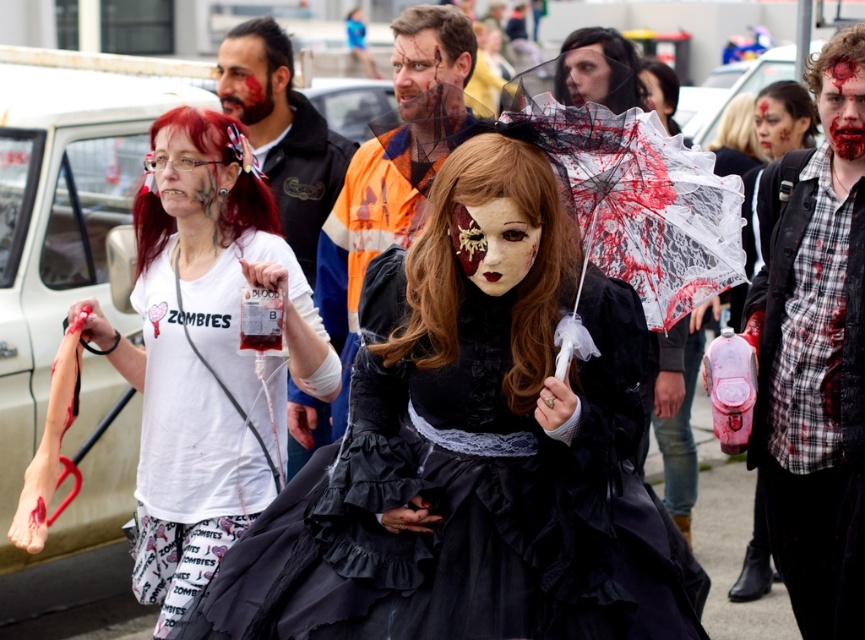
Question: Which is nearer to the matte plastic face at center?

Choices:
 (A) matte black mask at center
 (B) plaid fabric shirt at center

Answer: (A)

Question: Can you confirm if matte black mask at center is thinner than matte black umbrella at upper center?

Choices:
 (A) yes
 (B) no

Answer: (B)

Question: Is the position of blood-stained skin at center more distant than that of smooth skin face at center?

Choices:
 (A) no
 (B) yes

Answer: (A)

Question: Which object is closer to the camera taking this photo?

Choices:
 (A) smooth skin face at center
 (B) matte black face at upper center
 (C) matte black umbrella at upper center
 (D) matte plastic face at center

Answer: (C)

Question: Which object is farther from the camera taking this photo?

Choices:
 (A) plaid fabric shirt at center
 (B) matte black mask at center
 (C) black satin dress at center
 (D) blood-stained skin at center

Answer: (D)

Question: Can you confirm if white matte t-shirt at center is positioned below matte white face at upper left?

Choices:
 (A) yes
 (B) no

Answer: (A)